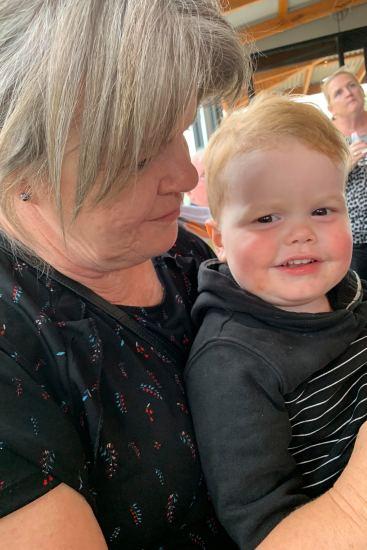
This screenshot has height=550, width=367. In order to click on wall in this screenshot , I will do `click(297, 31)`.